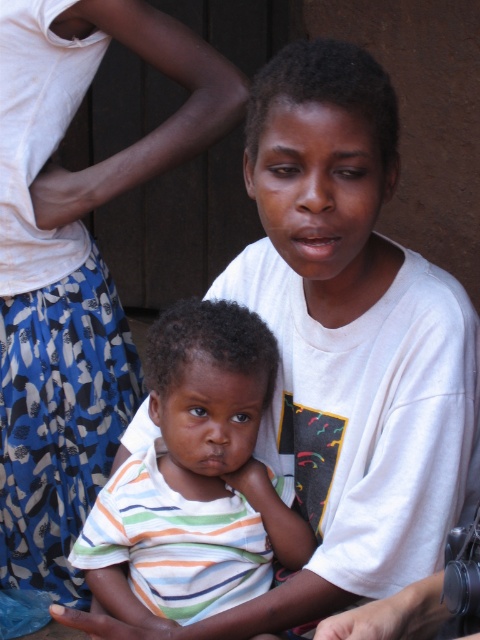
Can you confirm if white cotton shirt at upper center is positioned above striped cotton shirt at center?

Correct, white cotton shirt at upper center is located above striped cotton shirt at center.

Based on the photo, measure the distance from white cotton shirt at upper center to striped cotton shirt at center.

white cotton shirt at upper center is 22.90 inches away from striped cotton shirt at center.

Which is in front, point (39, 252) or point (269, 524)?

Point (269, 524)

You are a GUI agent. You are given a task and a screenshot of the screen. Output one action in this format:
    pyautogui.click(x=<x>, y=<y>)
    Task: Click on the white cotton shirt at upper center
    
    Given the screenshot: What is the action you would take?
    pyautogui.click(x=74, y=264)